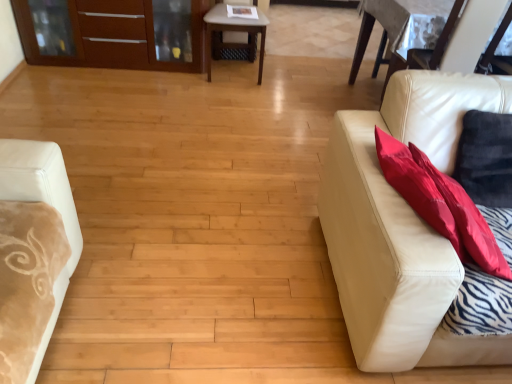
Question: Is leather couch at right completely or partially outside of matte wood dresser at upper left?

Choices:
 (A) yes
 (B) no

Answer: (A)

Question: Is matte wood dresser at upper left a part of leather couch at right?

Choices:
 (A) no
 (B) yes

Answer: (A)

Question: From a real-world perspective, does leather couch at right sit lower than matte wood dresser at upper left?

Choices:
 (A) no
 (B) yes

Answer: (A)

Question: Does leather couch at right have a larger size compared to matte wood dresser at upper left?

Choices:
 (A) no
 (B) yes

Answer: (B)

Question: Could you tell me if leather couch at right is turned towards matte wood dresser at upper left?

Choices:
 (A) no
 (B) yes

Answer: (A)

Question: Is leather couch at right in front of or behind light brown wooden table at center in the image?

Choices:
 (A) front
 (B) behind

Answer: (A)

Question: Is leather couch at right spatially inside light brown wooden table at center, or outside of it?

Choices:
 (A) inside
 (B) outside

Answer: (B)

Question: From a real-world perspective, is leather couch at right above or below light brown wooden table at center?

Choices:
 (A) below
 (B) above

Answer: (B)

Question: Is leather couch at right taller or shorter than light brown wooden table at center?

Choices:
 (A) short
 (B) tall

Answer: (B)

Question: Is leather couch at right in front of or behind matte wood dresser at upper left in the image?

Choices:
 (A) front
 (B) behind

Answer: (A)

Question: Considering the positions of leather couch at right and matte wood dresser at upper left in the image, is leather couch at right bigger or smaller than matte wood dresser at upper left?

Choices:
 (A) big
 (B) small

Answer: (A)

Question: Would you say leather couch at right is to the left or to the right of matte wood dresser at upper left in the picture?

Choices:
 (A) left
 (B) right

Answer: (B)

Question: Considering the positions of leather couch at right and matte wood dresser at upper left in the image, is leather couch at right wider or thinner than matte wood dresser at upper left?

Choices:
 (A) thin
 (B) wide

Answer: (B)

Question: In terms of width, does light brown wooden table at center look wider or thinner when compared to leather couch at right?

Choices:
 (A) wide
 (B) thin

Answer: (B)

Question: From the image's perspective, is light brown wooden table at center positioned above or below leather couch at right?

Choices:
 (A) above
 (B) below

Answer: (A)